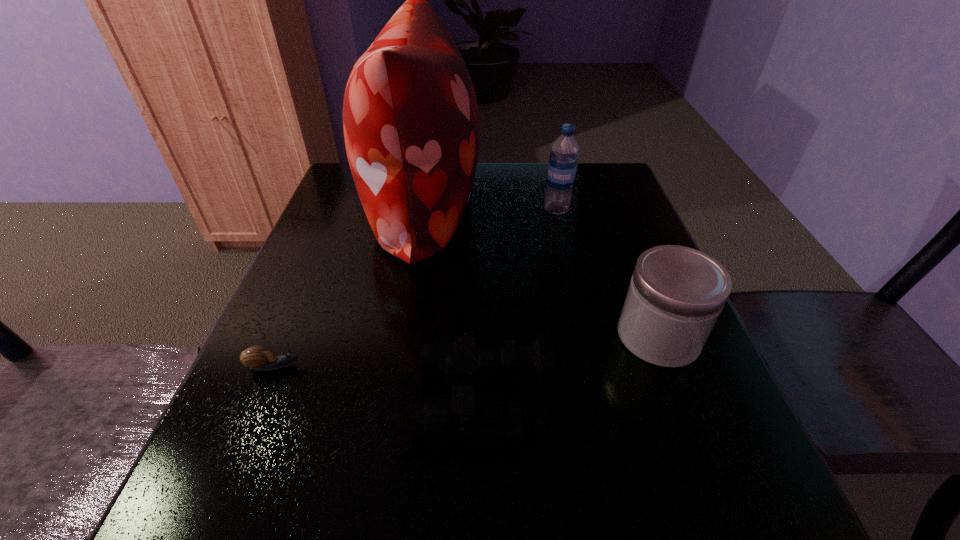
Where is `vacant space situated on the label of the water bottle`? The width and height of the screenshot is (960, 540). vacant space situated on the label of the water bottle is located at coordinates (500, 210).

Identify the location of free region located on the label of the water bottle. (508, 210).

I want to click on vacant space located on the front of the third shortest object, so click(729, 516).

At what (x,y) coordinates should I click in order to perform the action: click on vacant space positioned on the front lenses of the second shortest object. Please return your answer as a coordinate pair (x, y). This screenshot has width=960, height=540. Looking at the image, I should click on (365, 400).

The height and width of the screenshot is (540, 960). Identify the location of vacant space located on the front lenses of the second shortest object. (310, 400).

This screenshot has height=540, width=960. Find the location of `blank area located 0.310m on the front lenses of the second shortest object`. blank area located 0.310m on the front lenses of the second shortest object is located at coordinates (231, 400).

The image size is (960, 540). What are the coordinates of `vacant space located on the front-facing side of the escargot` in the screenshot? It's located at (407, 366).

Locate an element on the screen. cushion located at the far edge is located at coordinates [410, 118].

Image resolution: width=960 pixels, height=540 pixels. Identify the location of water bottle present at the far edge. (563, 160).

At what (x,y) coordinates should I click in order to perform the action: click on cushion positioned at the left edge. Please return your answer as a coordinate pair (x, y). The width and height of the screenshot is (960, 540). Looking at the image, I should click on (410, 118).